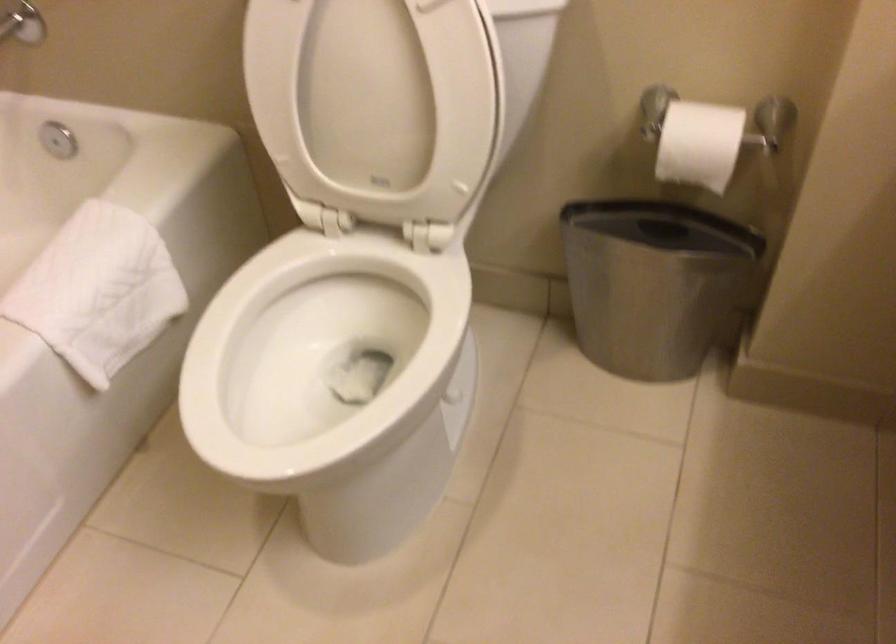
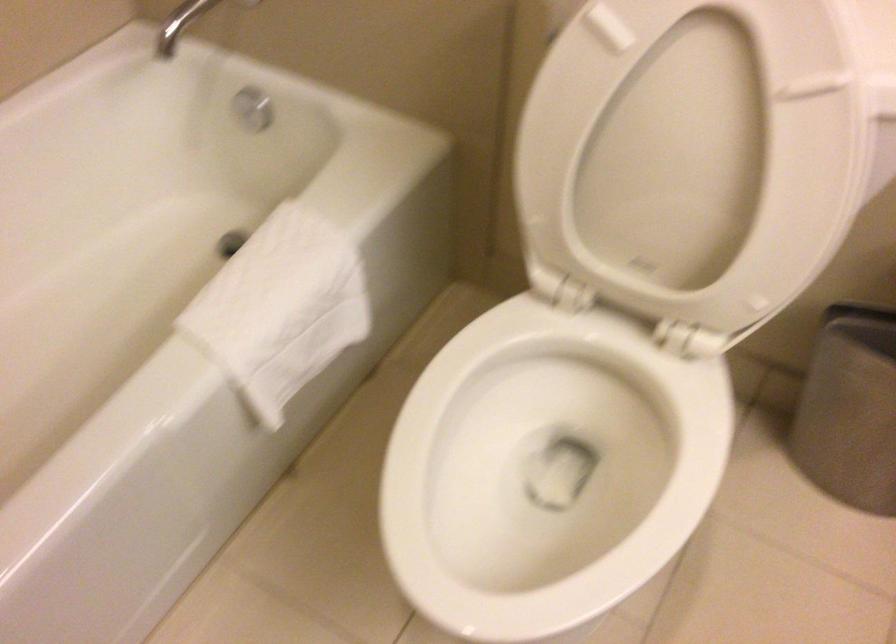
Find the pixel in the second image that matches point 345,377 in the first image.

(547, 469)